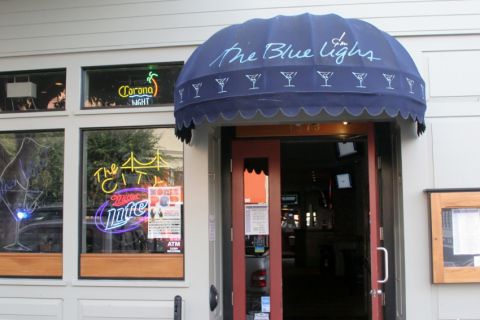
You are a GUI agent. You are given a task and a screenshot of the screen. Output one action in this format:
    pyautogui.click(x=<x>, y=<y>)
    Task: Click on the door
    
    Given the screenshot: What is the action you would take?
    pyautogui.click(x=304, y=247)